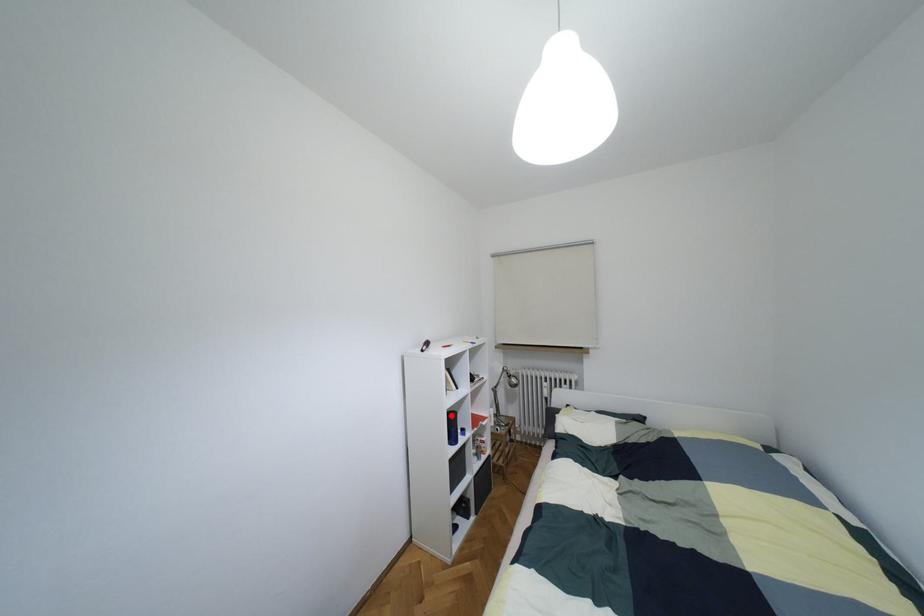
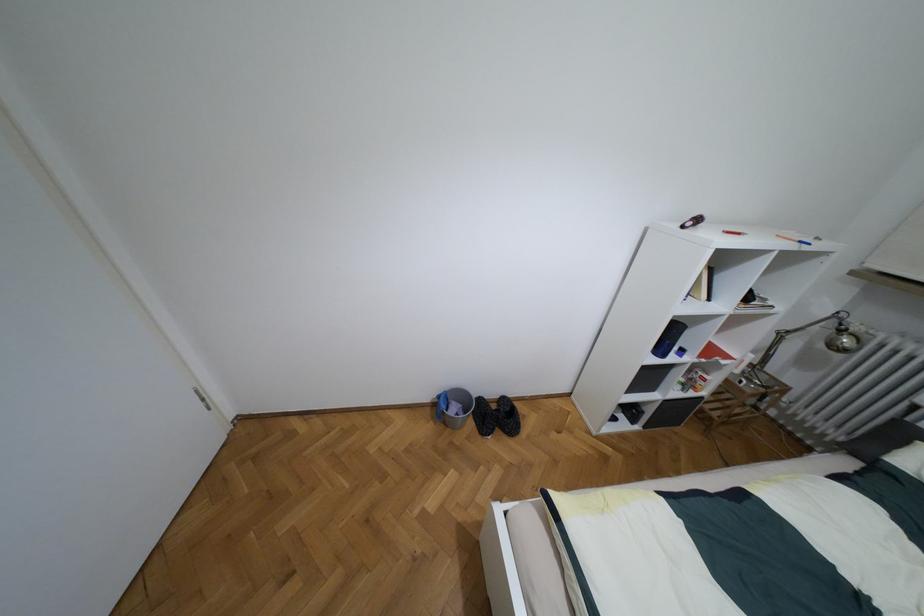
Question: A red point is marked in image1. In image2, is the corresponding 3D point closer to the camera or farther? Reply with the corresponding letter.

Choices:
 (A) The corresponding 3D point is closer.
 (B) The corresponding 3D point is farther.

Answer: (A)